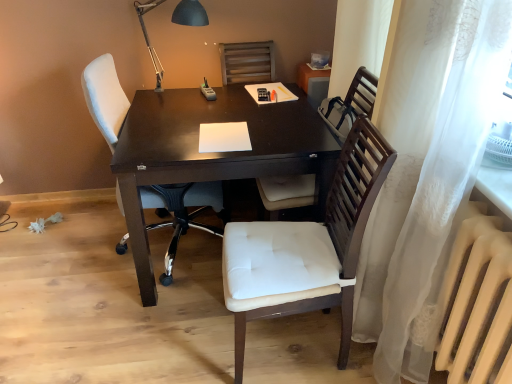
Question: Should I look upward or downward to see black metal table lamp at upper center?

Choices:
 (A) up
 (B) down

Answer: (A)

Question: Is black metal table lamp at upper center placed right next to white paper at center?

Choices:
 (A) yes
 (B) no

Answer: (B)

Question: Is black metal table lamp at upper center bigger than white paper at center?

Choices:
 (A) yes
 (B) no

Answer: (A)

Question: Does black metal table lamp at upper center come in front of white paper at center?

Choices:
 (A) no
 (B) yes

Answer: (A)

Question: Could you tell me if black metal table lamp at upper center is facing white paper at center?

Choices:
 (A) yes
 (B) no

Answer: (A)

Question: Considering the relative sizes of black metal table lamp at upper center and white paper at center in the image provided, is black metal table lamp at upper center taller than white paper at center?

Choices:
 (A) yes
 (B) no

Answer: (A)

Question: From a real-world perspective, is black metal table lamp at upper center on top of white paper at center?

Choices:
 (A) yes
 (B) no

Answer: (A)

Question: Are white paper at center and white fabric chair at left, which is counted as the first chair, starting from the left, located far from each other?

Choices:
 (A) no
 (B) yes

Answer: (A)

Question: Is white paper at center turned away from white fabric chair at left, which is the third chair from right to left?

Choices:
 (A) no
 (B) yes

Answer: (B)

Question: Would you say white paper at center contains white fabric chair at left, which is counted as the first chair, starting from the left?

Choices:
 (A) yes
 (B) no

Answer: (B)

Question: From the image's perspective, would you say white paper at center is positioned over white fabric chair at left, which is counted as the first chair, starting from the left?

Choices:
 (A) no
 (B) yes

Answer: (B)

Question: Is white paper at center aimed at white fabric chair at left, which is the third chair from right to left?

Choices:
 (A) no
 (B) yes

Answer: (B)

Question: From the image's perspective, is white paper at center located beneath white fabric chair at left, which is counted as the first chair, starting from the left?

Choices:
 (A) yes
 (B) no

Answer: (B)

Question: Can you confirm if wooden chair at center, the 1th chair from the right, is wider than white matte radiator at lower right?

Choices:
 (A) no
 (B) yes

Answer: (B)